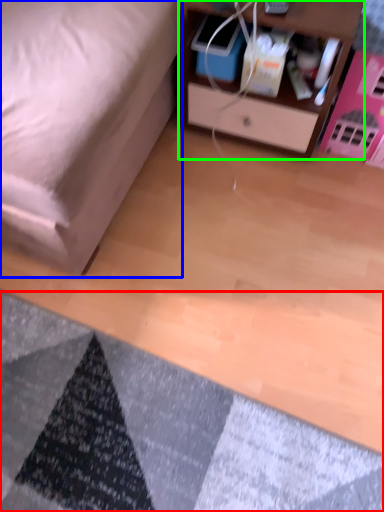
Question: Estimate the real-world distances between objects in this image. Which object is closer to mat (highlighted by a red box), furniture (highlighted by a blue box) or nightstand (highlighted by a green box)?

Choices:
 (A) furniture
 (B) nightstand

Answer: (A)